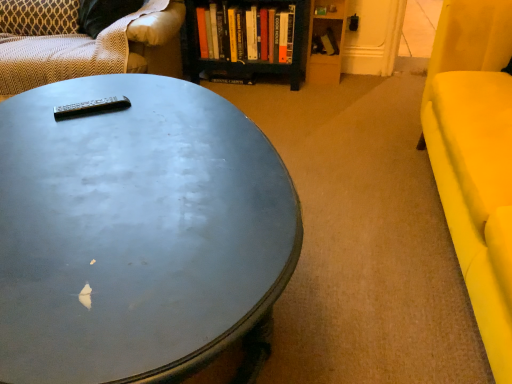
Locate an element on the screen. free location to the left of matte yellow armchair at right is located at coordinates (362, 240).